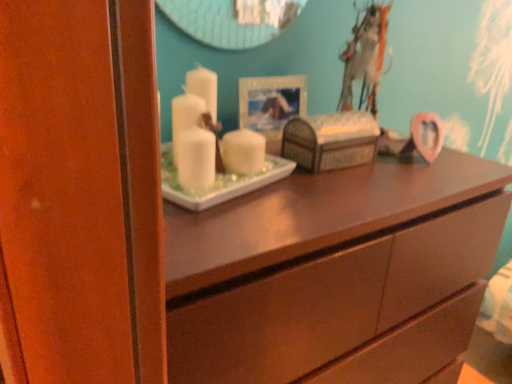
What are the coordinates of `vacant point above matte brown chest of drawers at center (from a real-world perspective)` in the screenshot? It's located at (342, 181).